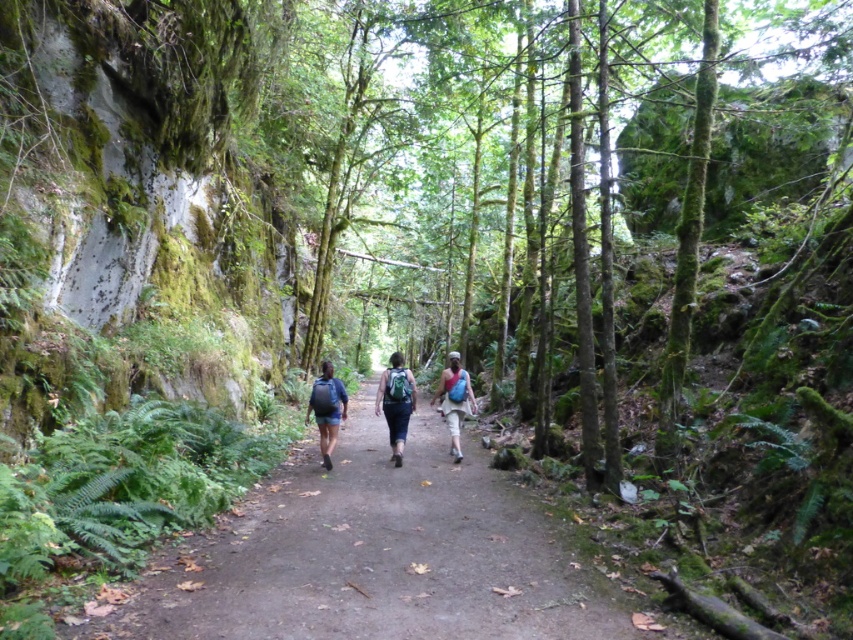
Question: Observing the image, what is the correct spatial positioning of matte blue backpacks at center in reference to matte blue backpack at center?

Choices:
 (A) right
 (B) left

Answer: (A)

Question: Which point appears closest to the camera in this image?

Choices:
 (A) (519, 545)
 (B) (457, 358)
 (C) (399, 368)
 (D) (332, 378)

Answer: (A)

Question: Among these points, which one is nearest to the camera?

Choices:
 (A) (393, 428)
 (B) (329, 422)
 (C) (474, 408)
 (D) (567, 634)

Answer: (D)

Question: Which of the following is the closest to the observer?

Choices:
 (A) blue fabric backpack at center
 (B) green fabric backpack at center
 (C) matte blue backpacks at center

Answer: (C)

Question: Is green fabric backpack at center positioned at the back of matte blue backpack at center?

Choices:
 (A) no
 (B) yes

Answer: (B)

Question: Does brown dirt trail at center come behind green fabric backpack at center?

Choices:
 (A) no
 (B) yes

Answer: (A)